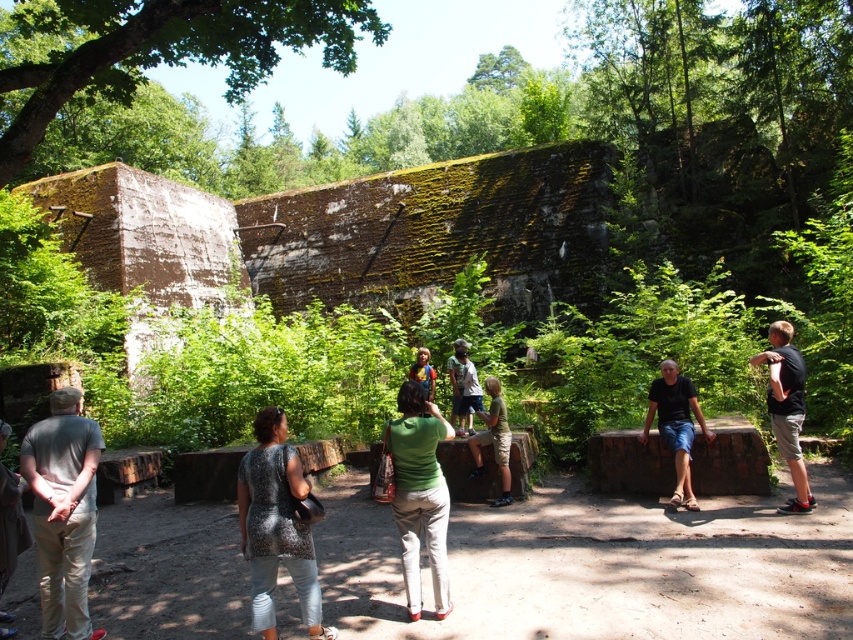
You are a hiker who wants to sit down and rest. You see the khaki shorts at center and the light brown wooden bench at center in front of you. Which object is wider so you can choose the bench to sit on?

The light brown wooden bench at center is wider than the khaki shorts at center, so you can choose the bench to sit on.

You are standing at the center of the image and want to locate the gray fabric shirt at lower left. In which direction should you look to find it?

You should look to the lower left direction to find the gray fabric shirt at lower left since its 2D location is at point (x=10, y=524).